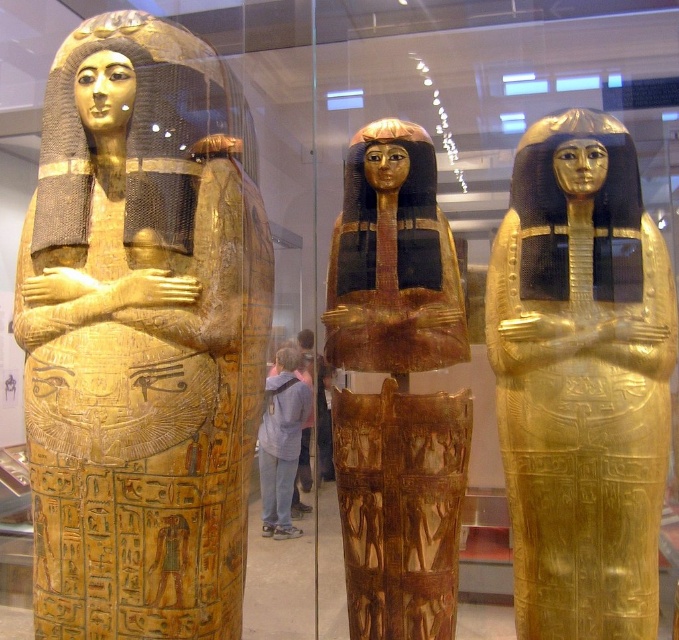
Question: Does gold polished sarcophagus at left appear over gold polished wood sarcophagus at center?

Choices:
 (A) yes
 (B) no

Answer: (A)

Question: Estimate the real-world distances between objects in this image. Which object is farther from the gold polished sarcophagus at left?

Choices:
 (A) gold polished sarcophagus at center
 (B) gold polished wood sarcophagus at center

Answer: (A)

Question: Which point is farther to the camera?

Choices:
 (A) gold polished sarcophagus at left
 (B) gold polished sarcophagus at center

Answer: (B)

Question: Does gold polished sarcophagus at left have a lesser width compared to gold polished wood sarcophagus at center?

Choices:
 (A) yes
 (B) no

Answer: (B)

Question: Is gold polished sarcophagus at center below gold polished wood sarcophagus at center?

Choices:
 (A) no
 (B) yes

Answer: (A)

Question: Which object appears closest to the camera in this image?

Choices:
 (A) gold polished sarcophagus at center
 (B) gold polished wood sarcophagus at center
 (C) gold polished sarcophagus at left

Answer: (C)